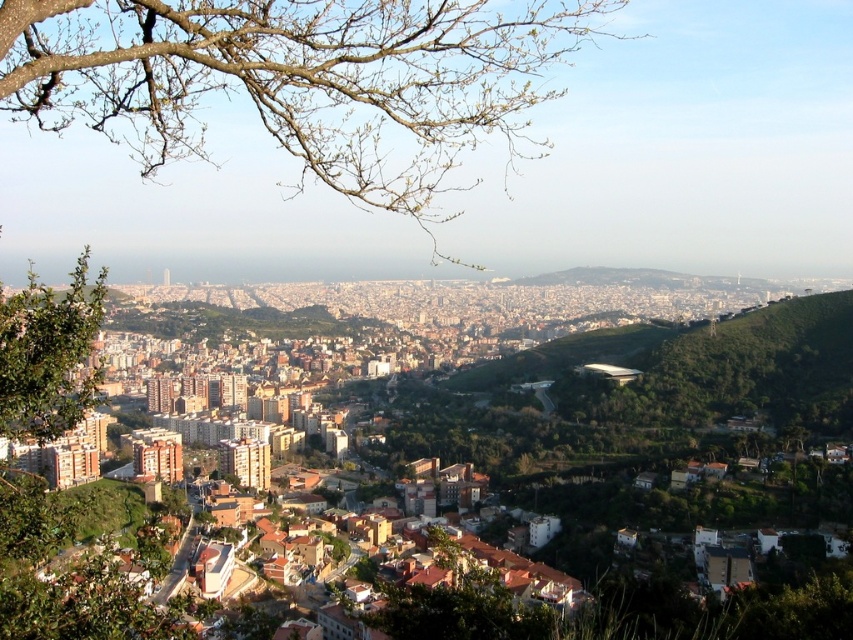
Can you confirm if bare branches at upper left is taller than green leafy tree at left?

Yes.

Does bare branches at upper left appear over green leafy tree at left?

Yes, bare branches at upper left is above green leafy tree at left.

Who is more forward, (x=442, y=67) or (x=94, y=314)?

Point (x=94, y=314)

The width and height of the screenshot is (853, 640). I want to click on bare branches at upper left, so click(300, 81).

Can you confirm if brown brick buildings at center is bigger than green leafy tree at left?

Yes.

Based on the photo, how far apart are brown brick buildings at center and green leafy tree at left?

brown brick buildings at center and green leafy tree at left are 125.70 meters apart from each other.

Is point (718, 515) more distant than point (3, 580)?

Yes, it is.

Where is `brown brick buildings at center`? brown brick buildings at center is located at coordinates (689, 424).

From the picture: Is bare branches at upper left wider than brown brick buildings at center?

Yes.

Is bare branches at upper left above brown brick buildings at center?

Indeed, bare branches at upper left is positioned over brown brick buildings at center.

Does point (392, 19) come behind point (733, 390)?

No, (392, 19) is closer to viewer.

At what (x,y) coordinates should I click in order to perform the action: click on bare branches at upper left. Please return your answer as a coordinate pair (x, y). Image resolution: width=853 pixels, height=640 pixels. Looking at the image, I should click on (300, 81).